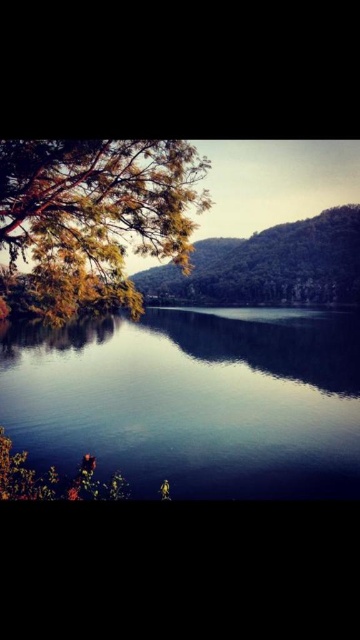
Question: Is smooth reflective water at center positioned behind green matte tree at center?

Choices:
 (A) no
 (B) yes

Answer: (A)

Question: Where is smooth reflective water at center located in relation to green leafy tree at upper left in the image?

Choices:
 (A) left
 (B) right

Answer: (B)

Question: Which object is positioned farthest from the green leafy tree at upper left?

Choices:
 (A) smooth reflective water at center
 (B) green matte tree at center

Answer: (B)

Question: Which point is closer to the camera taking this photo?

Choices:
 (A) (119, 317)
 (B) (7, 221)
 (C) (342, 269)

Answer: (B)

Question: Among these points, which one is nearest to the camera?

Choices:
 (A) (249, 401)
 (B) (105, 202)

Answer: (B)

Question: Observing the image, what is the correct spatial positioning of smooth reflective water at center in reference to green matte tree at center?

Choices:
 (A) above
 (B) below

Answer: (B)